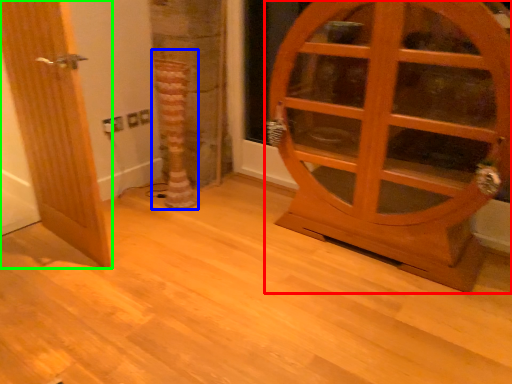
Question: Based on their relative distances, which object is nearer to door (highlighted by a red box)? Choose from tree trunk (highlighted by a blue box) and door (highlighted by a green box).

Choices:
 (A) tree trunk
 (B) door

Answer: (A)